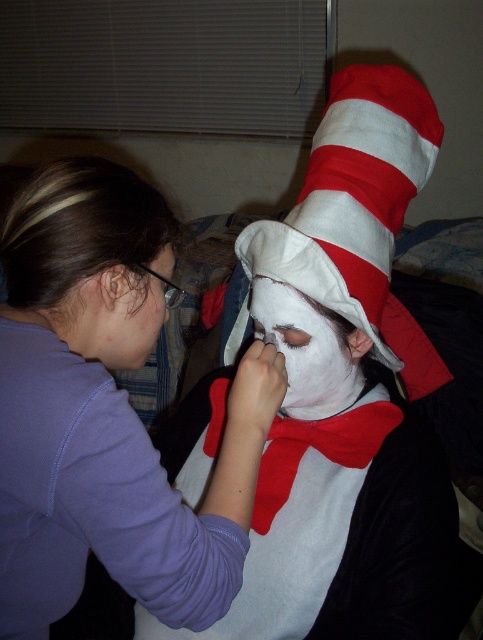
Question: Which point is closer to the camera taking this photo?

Choices:
 (A) (18, 624)
 (B) (409, 445)
 (C) (332, 307)

Answer: (A)

Question: Does white matte face paint at center appear on the left side of white fabric hat at center?

Choices:
 (A) yes
 (B) no

Answer: (A)

Question: Can you confirm if purple fabric at upper left is positioned above white fabric hat at center?

Choices:
 (A) no
 (B) yes

Answer: (A)

Question: In this image, where is purple fabric at upper left located relative to white matte face paint at center?

Choices:
 (A) above
 (B) below

Answer: (A)

Question: Based on their relative distances, which object is nearer to the white fabric hat at center?

Choices:
 (A) white matte face paint at center
 (B) purple fabric at upper left

Answer: (A)

Question: Which of the following is the closest to the observer?

Choices:
 (A) purple fabric at upper left
 (B) white fabric hat at center

Answer: (A)